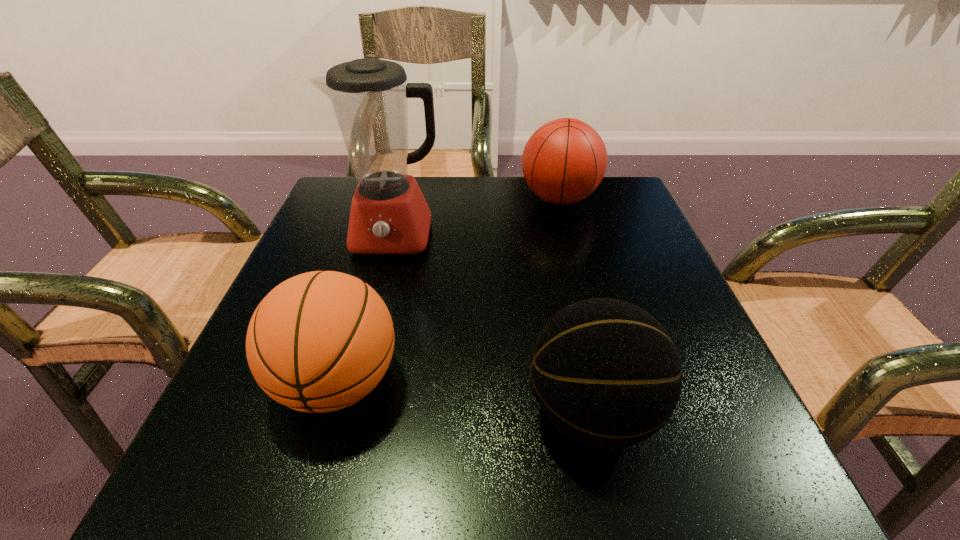
Where is `the tallest object`? The height and width of the screenshot is (540, 960). the tallest object is located at coordinates (389, 215).

The width and height of the screenshot is (960, 540). Identify the location of the farthest basketball. (564, 161).

This screenshot has width=960, height=540. I want to click on the leftmost basketball, so click(x=320, y=341).

Image resolution: width=960 pixels, height=540 pixels. I want to click on free region located 0.080m on the front of the tallest object near the controls, so click(381, 287).

The image size is (960, 540). Identify the location of free point located on the left of the farthest basketball. (474, 199).

Where is `vacant position located on the right of the leftmost basketball`? vacant position located on the right of the leftmost basketball is located at coordinates (526, 382).

Find the location of a particular element. The image size is (960, 540). blender that is positioned at the far edge is located at coordinates (389, 215).

Where is `basketball located in the far edge section of the desktop`? This screenshot has height=540, width=960. basketball located in the far edge section of the desktop is located at coordinates (564, 161).

Find the location of a particular element. Image resolution: width=960 pixels, height=540 pixels. blender that is at the left edge is located at coordinates (389, 215).

The image size is (960, 540). In order to click on basketball located at the left edge in this screenshot , I will do `click(320, 341)`.